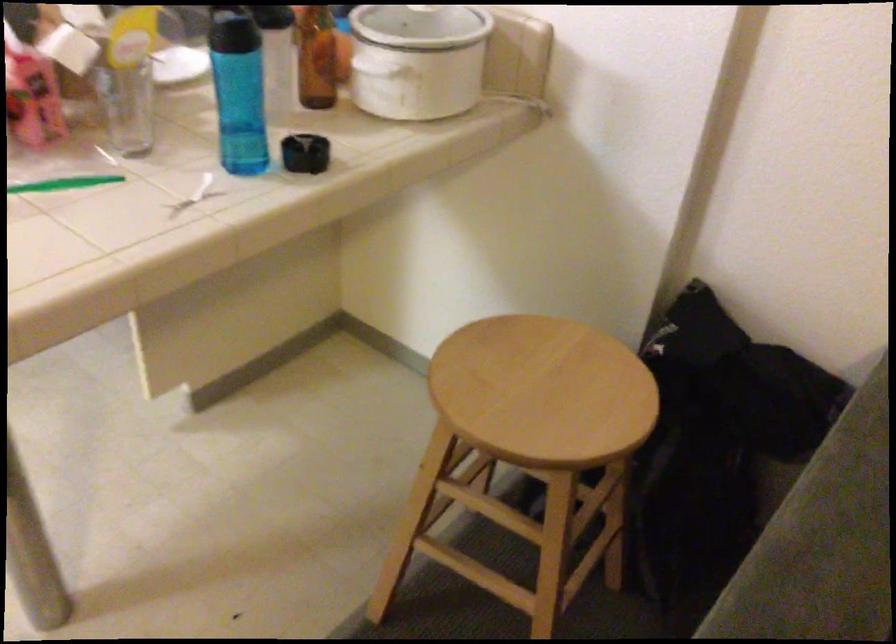
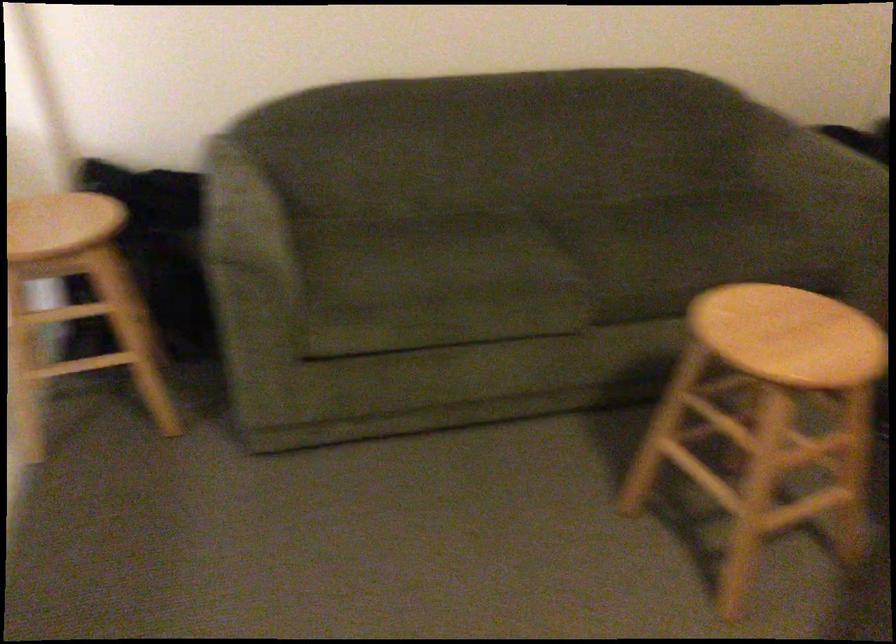
In the second image, find the point that corresponds to (807,552) in the first image.

(236, 210)